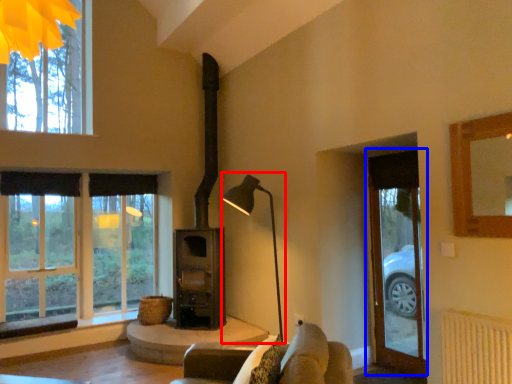
Question: Which object is further to the camera taking this photo, table lamp (highlighted by a red box) or glass door (highlighted by a blue box)?

Choices:
 (A) table lamp
 (B) glass door

Answer: (A)